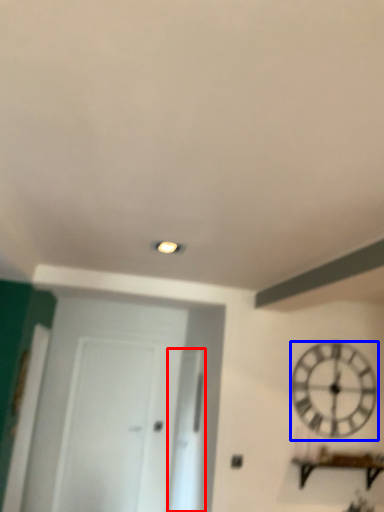
Question: Among these objects, which one is nearest to the camera, glass door (highlighted by a red box) or wall clock (highlighted by a blue box)?

Choices:
 (A) glass door
 (B) wall clock

Answer: (B)